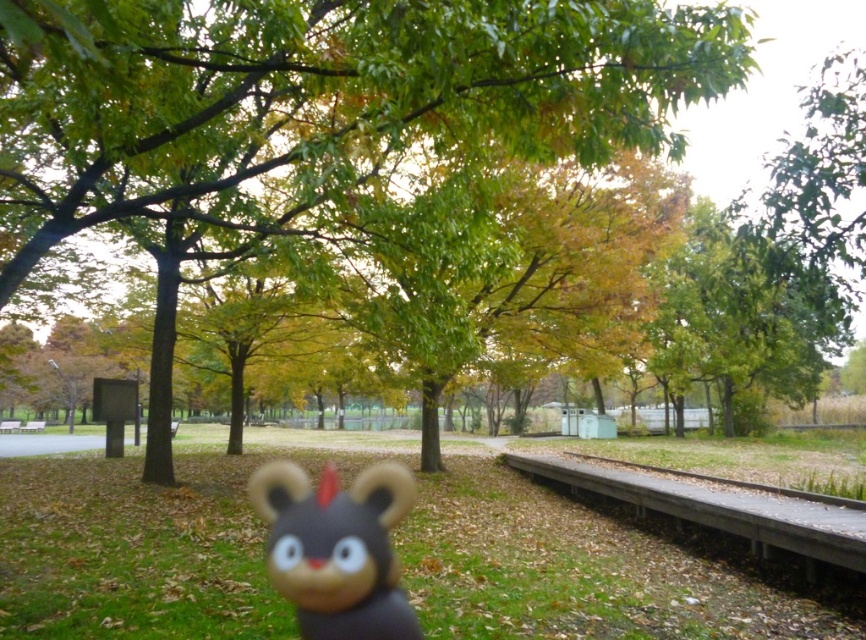
You are a park visitor who wants to sit on the wooden park bench at center. However, there is a fuzzy brown plush toy at center in the way. Can you still sit on the bench?

The fuzzy brown plush toy at center is positioned over the wooden park bench at center, so it is blocking access to the bench. You would need to move the toy to sit there.

You are standing in the park and want to walk to both the point at coordinates (56, 209) and the point at coordinates (33, 428). Which point will you reach first if you start walking towards them from your current position?

You will reach the point at coordinates (56, 209) first because it is closer to you than the point at coordinates (33, 428).

You are a park visitor who wants to sit down and rest. You see the green leafy tree at center and the wooden park bench at center. Which object is larger in size?

The green leafy tree at center is bigger than the wooden park bench at center.